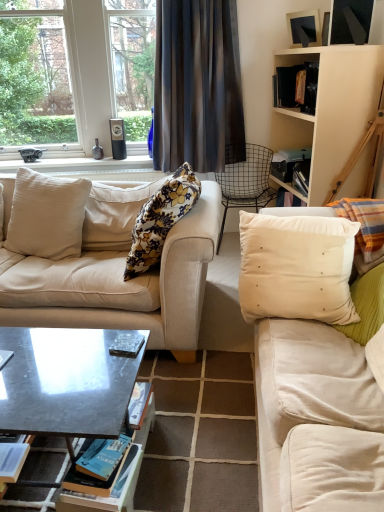
Locate an element on the screen. This screenshot has height=512, width=384. wire mesh chair at center is located at coordinates (245, 180).

Image resolution: width=384 pixels, height=512 pixels. Describe the element at coordinates (127, 344) in the screenshot. I see `wooden book at center, which ranks as the 1th book in top-to-bottom order` at that location.

Locate an element on the screen. The image size is (384, 512). wooden book at center, which ranks as the 1th book in top-to-bottom order is located at coordinates (127, 344).

This screenshot has width=384, height=512. What do you see at coordinates (103, 261) in the screenshot?
I see `beige fabric couch at center` at bounding box center [103, 261].

The width and height of the screenshot is (384, 512). Find the location of `metallic silver picture frame at upper right`. metallic silver picture frame at upper right is located at coordinates (304, 28).

Measure the distance between point (x=311, y=22) and camera.

The distance of point (x=311, y=22) from camera is 8.93 feet.

The height and width of the screenshot is (512, 384). Describe the element at coordinates (197, 86) in the screenshot. I see `dark gray sheer curtain at upper center` at that location.

Measure the distance between point (x=366, y=115) and camera.

Point (x=366, y=115) is 8.45 feet from camera.

Measure the distance between hardcover book at center, placed as the first book when sorted from bottom to top, and camera.

A distance of 4.19 feet exists between hardcover book at center, placed as the first book when sorted from bottom to top, and camera.

At what (x,y) coordinates should I click in order to perform the action: click on wire mesh chair at center. Please return your answer as a coordinate pair (x, y). Image resolution: width=384 pixels, height=512 pixels. Looking at the image, I should click on (245, 180).

Locate an element on the screen. the 2nd pillow below when counting from the beige fabric pillow at left, the 4th pillow when ordered from right to left (from the image's perspective) is located at coordinates (364, 229).

From the image's perspective, is beige fabric pillow at left, the 1th pillow positioned from the left, positioned above or below white satin pillow at right, the fourth pillow when ordered from left to right?

From the image's perspective, beige fabric pillow at left, the 1th pillow positioned from the left, appears above white satin pillow at right, the fourth pillow when ordered from left to right.

In terms of height, does beige fabric pillow at left, the 4th pillow when ordered from right to left, look taller or shorter compared to white satin pillow at right, the 1th pillow positioned from the right?

beige fabric pillow at left, the 4th pillow when ordered from right to left, is taller than white satin pillow at right, the 1th pillow positioned from the right.

Would you consider beige fabric pillow at left, the 4th pillow when ordered from right to left, to be distant from white satin pillow at right, the fourth pillow when ordered from left to right?

beige fabric pillow at left, the 4th pillow when ordered from right to left, is far away from white satin pillow at right, the fourth pillow when ordered from left to right.

Does beige fabric couch at center have a greater width compared to white satin pillow at right, the 1th pillow positioned from the right?

Yes, beige fabric couch at center is wider than white satin pillow at right, the 1th pillow positioned from the right.

Does beige fabric couch at center have a smaller size compared to white satin pillow at right, the 1th pillow positioned from the right?

Incorrect, beige fabric couch at center is not smaller in size than white satin pillow at right, the 1th pillow positioned from the right.

Do you think beige fabric couch at center is within white satin pillow at right, the fourth pillow when ordered from left to right, or outside of it?

beige fabric couch at center is outside white satin pillow at right, the fourth pillow when ordered from left to right.

Between point (114, 255) and point (379, 206), which one is positioned behind?

The point (114, 255) is behind.

Is beige wood cabinet at upper right oriented away from matte black speaker at upper left?

No, beige wood cabinet at upper right is not facing the opposite direction of matte black speaker at upper left.

Is beige wood cabinet at upper right completely or partially outside of matte black speaker at upper left?

Absolutely, beige wood cabinet at upper right is external to matte black speaker at upper left.

Which of these two, beige wood cabinet at upper right or matte black speaker at upper left, is thinner?

matte black speaker at upper left.

Is white satin pillow at right, the 1th pillow positioned from the right, smaller than dark gray polished wood coffee table at center?

Yes.

Considering the sizes of objects white satin pillow at right, the 1th pillow positioned from the right, and dark gray polished wood coffee table at center in the image provided, who is taller, white satin pillow at right, the 1th pillow positioned from the right, or dark gray polished wood coffee table at center?

With more height is dark gray polished wood coffee table at center.

Between dark gray sheer curtain at upper center and wire mesh chair at center, which one is positioned in front?

dark gray sheer curtain at upper center is more forward.

Looking at this image, considering the positions of objects dark gray sheer curtain at upper center and wire mesh chair at center in the image provided, who is more to the right, dark gray sheer curtain at upper center or wire mesh chair at center?

Positioned to the right is wire mesh chair at center.

From the image's perspective, who appears lower, dark gray sheer curtain at upper center or wire mesh chair at center?

wire mesh chair at center, from the image's perspective.

Looking at this image, is dark gray sheer curtain at upper center oriented away from wire mesh chair at center?

dark gray sheer curtain at upper center does not have its back to wire mesh chair at center.

Considering the positions of points (112, 354) and (4, 124), is point (112, 354) closer to camera compared to point (4, 124)?

Yes, point (112, 354) is in front of point (4, 124).

From the image's perspective, is wooden book at center, which is the 1th book from right to left, below clear glass window at upper left?

Indeed, from the image's perspective, wooden book at center, which is the 1th book from right to left, is shown beneath clear glass window at upper left.

Does wooden book at center, which is the 1th book from right to left, touch clear glass window at upper left?

No, wooden book at center, which is the 1th book from right to left, is not with clear glass window at upper left.

Is wooden book at center, the third book positioned from the bottom, facing away from clear glass window at upper left?

No, clear glass window at upper left is not at the back of wooden book at center, the third book positioned from the bottom.

Considering the relative sizes of beige velvet cushion at right, which ranks as the second pillow in right-to-left order, and metallic gray book at center, the 3th book when ordered from right to left, in the image provided, is beige velvet cushion at right, which ranks as the second pillow in right-to-left order, bigger than metallic gray book at center, the 3th book when ordered from right to left,?

Correct, beige velvet cushion at right, which ranks as the second pillow in right-to-left order, is larger in size than metallic gray book at center, the 3th book when ordered from right to left.

From the picture: Does beige velvet cushion at right, which ranks as the second pillow in right-to-left order, lie behind metallic gray book at center, acting as the first book starting from the left?

Yes, beige velvet cushion at right, which ranks as the second pillow in right-to-left order, is further from the viewer.

Looking at this image, from the image's perspective, is beige velvet cushion at right, which is the third pillow from left to right, below metallic gray book at center, marked as the 2th book in a bottom-to-top arrangement?

No.

From a real-world perspective, who is located higher, beige velvet cushion at right, which is the third pillow from left to right, or metallic gray book at center, acting as the first book starting from the left?

beige velvet cushion at right, which is the third pillow from left to right.

The image size is (384, 512). What are the coordinates of `pillow that is the 1st one below the white satin pillow at right, the fourth pillow when ordered from left to right (from a real-world perspective)` in the screenshot? It's located at coord(47,215).

The height and width of the screenshot is (512, 384). What are the coordinates of `studio couch to the left of white satin pillow at right, the fourth pillow when ordered from left to right` in the screenshot? It's located at (103, 261).

When comparing their distances from clear glass window at upper left, does white satin pillow at right, the 1th pillow positioned from the right, or beige fabric pillow at left, the 4th pillow when ordered from right to left, seem further?

white satin pillow at right, the 1th pillow positioned from the right, lies further to clear glass window at upper left than the other object.

Which object lies nearer to the anchor point white satin pillow at right, the 1th pillow positioned from the right, matte black speaker at upper left or hardcover book at center, the second book from the left?

hardcover book at center, the second book from the left.

Looking at the image, which one is located further to beige wood cabinet at upper right, clear glass window at upper left or dark gray sheer curtain at upper center?

clear glass window at upper left is further to beige wood cabinet at upper right.

Looking at this image, from the image, which object appears to be farther from beige fabric couch at center, beige fabric pillow at left, the 1th pillow positioned from the left, or beige wood cabinet at upper right?

beige wood cabinet at upper right is positioned further to the anchor beige fabric couch at center.

Considering their positions, is wire mesh chair at center positioned further to beige fabric pillow at left, the 1th pillow positioned from the left, than dark gray polished wood coffee table at center?

wire mesh chair at center.

Which object lies nearer to the anchor point beige wood cabinet at upper right, matte black speaker at upper left or dark gray polished wood coffee table at center?

matte black speaker at upper left.

Which object lies nearer to the anchor point clear glass window at upper left, wire mesh chair at center or beige fabric pillow at left, the 4th pillow when ordered from right to left?

beige fabric pillow at left, the 4th pillow when ordered from right to left, is positioned closer to the anchor clear glass window at upper left.

Looking at this image, when comparing their distances from floral fabric pillow at center, which appears as the second pillow when viewed from the left, does matte black speaker at upper left or hardcover book at center, the second book from the left, seem closer?

Among the two, hardcover book at center, the second book from the left, is located nearer to floral fabric pillow at center, which appears as the second pillow when viewed from the left.

This screenshot has width=384, height=512. In order to click on cabinetry that lies between metallic silver picture frame at upper right and wire mesh chair at center from top to bottom in this screenshot , I will do click(x=333, y=109).

You are a GUI agent. You are given a task and a screenshot of the screen. Output one action in this format:
    pyautogui.click(x=<x>, y=<y>)
    Task: Click on the curtain situated between clear glass window at upper left and metallic silver picture frame at upper right from left to right
    The width and height of the screenshot is (384, 512).
    Given the screenshot: What is the action you would take?
    pyautogui.click(x=197, y=86)

Image resolution: width=384 pixels, height=512 pixels. In order to click on curtain between floral fabric pillow at center, which appears as the second pillow when viewed from the left, and beige wood cabinet at upper right in this screenshot , I will do `click(197, 86)`.

Locate an element on the screen. curtain between clear glass window at upper left and dark gray polished wood coffee table at center vertically is located at coordinates pyautogui.click(x=197, y=86).